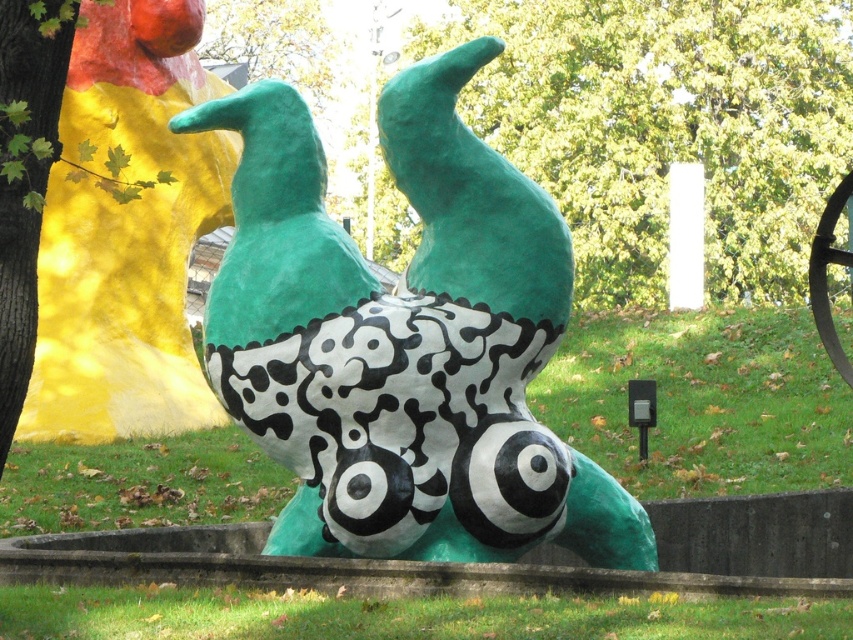
Question: Which of the following is the closest to the observer?

Choices:
 (A) matte green sculpture at center
 (B) green matte tree at upper center

Answer: (A)

Question: Which object appears closest to the camera in this image?

Choices:
 (A) matte green sculpture at center
 (B) green matte tree at upper center

Answer: (A)

Question: Is matte green sculpture at center wider than green matte tree at upper center?

Choices:
 (A) yes
 (B) no

Answer: (B)

Question: In this image, where is matte green sculpture at center located relative to green matte tree at upper center?

Choices:
 (A) below
 (B) above

Answer: (A)

Question: Which of the following is the closest to the observer?

Choices:
 (A) (648, 65)
 (B) (369, 390)

Answer: (B)

Question: Does matte green sculpture at center appear on the left side of green matte tree at upper center?

Choices:
 (A) no
 (B) yes

Answer: (B)